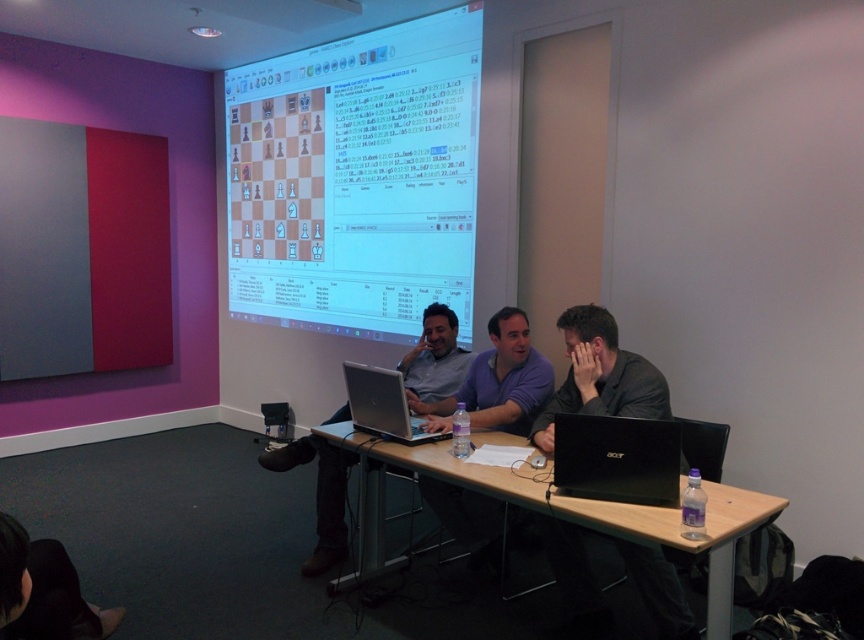
Question: Which of the following is the farthest from the observer?

Choices:
 (A) (30, 570)
 (B) (373, 218)
 (C) (638, 449)

Answer: (B)

Question: Is wooden table at center above black matte jacket at center?

Choices:
 (A) no
 (B) yes

Answer: (A)

Question: Which object is farther from the camera taking this photo?

Choices:
 (A) wooden table at center
 (B) white glossy projection screen at upper center
 (C) black matte laptop at lower right

Answer: (B)

Question: Is wooden table at center below silver metallic laptop at center?

Choices:
 (A) yes
 (B) no

Answer: (A)

Question: Among these points, which one is nearest to the camera?

Choices:
 (A) (691, 628)
 (B) (372, 182)
 (C) (11, 564)

Answer: (C)

Question: Does wooden table at center appear on the left side of black hair at lower left?

Choices:
 (A) yes
 (B) no

Answer: (B)